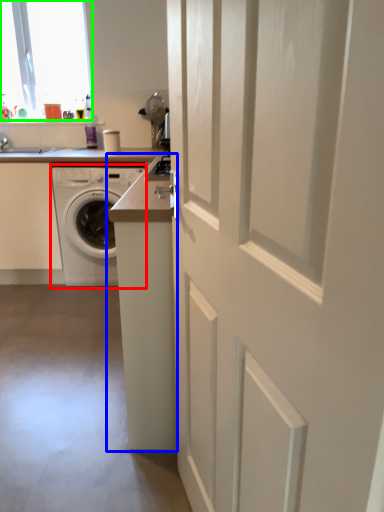
Question: Considering the real-world distances, which object is closest to washing machine (highlighted by a red box)? counter (highlighted by a blue box) or window (highlighted by a green box).

Choices:
 (A) counter
 (B) window

Answer: (B)